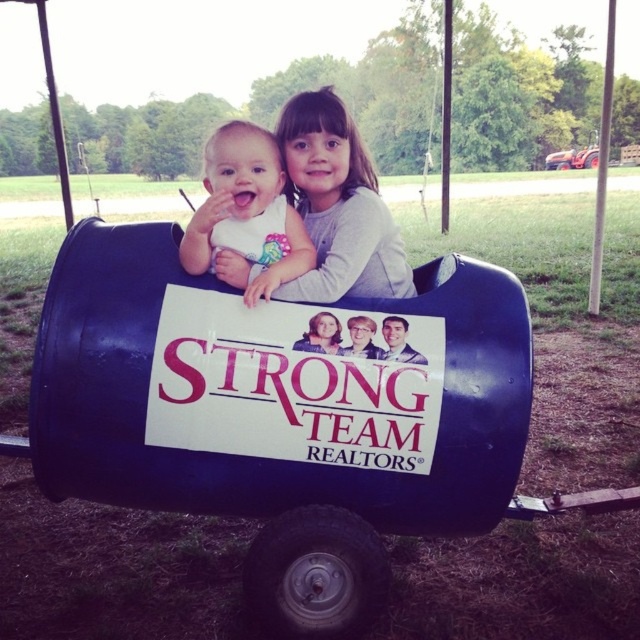
Is the position of gray soft shirt at upper center more distant than that of matte white bib at center?

Yes, it is.

Is gray soft shirt at upper center shorter than matte white bib at center?

Incorrect, gray soft shirt at upper center's height does not fall short of matte white bib at center's.

Is point (316, 161) closer to camera compared to point (268, 204)?

No, it is not.

What are the coordinates of `gray soft shirt at upper center` in the screenshot? It's located at (x=339, y=205).